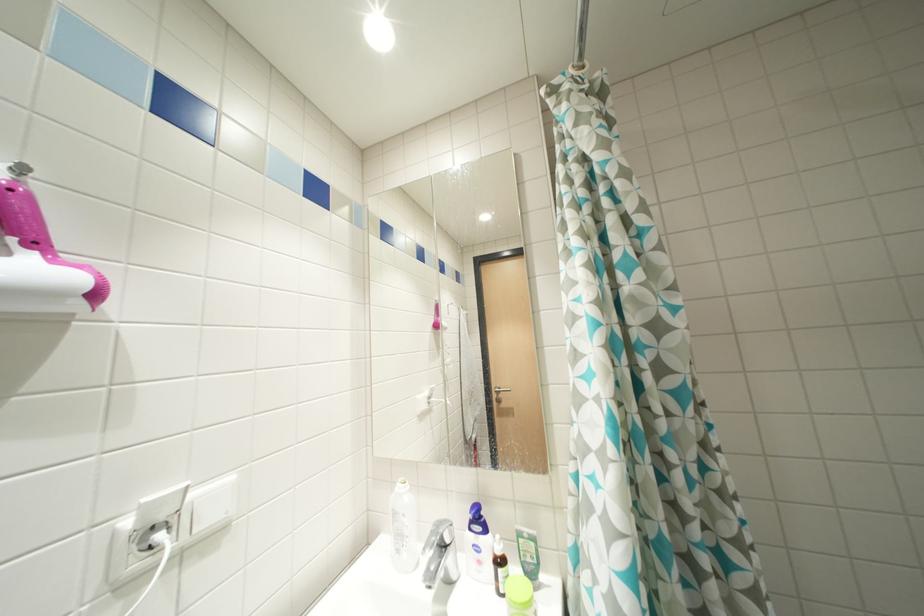
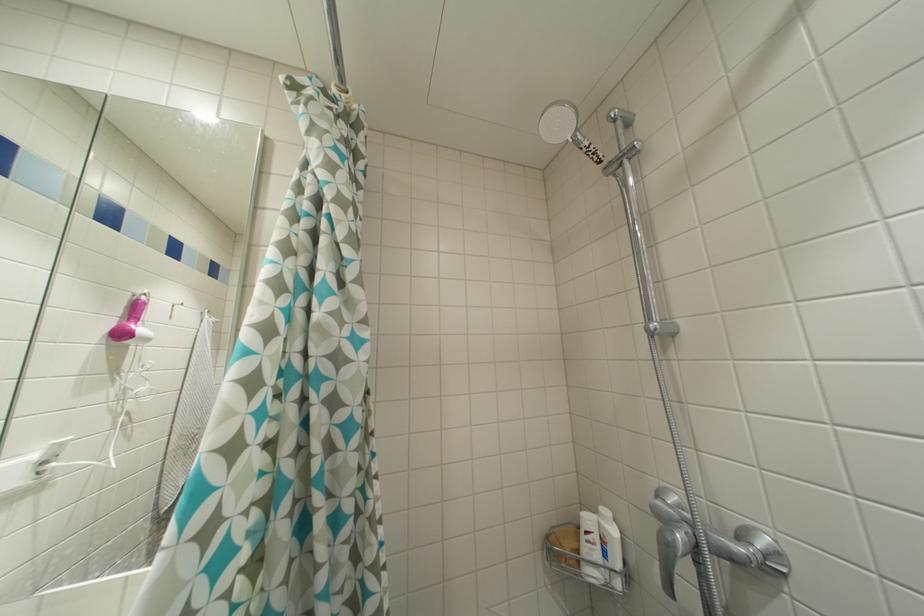
Question: The camera is either moving clockwise (left) or counter-clockwise (right) around the object. The first image is from the beginning of the video and the second image is from the end. Is the camera moving left or right when shooting the video?

Choices:
 (A) Left
 (B) Right

Answer: (A)